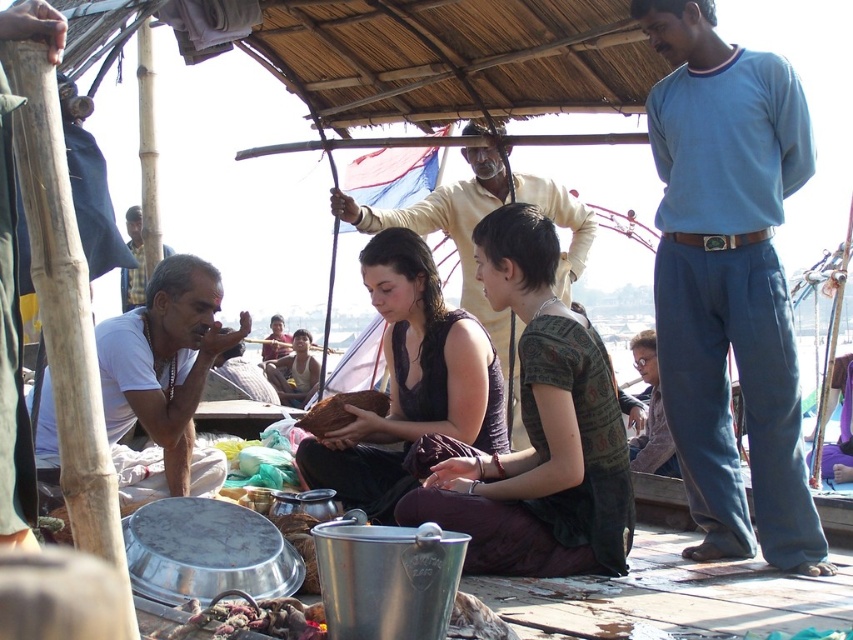
Question: Does matte brown purse at center appear on the right side of light brown fabric shirt at center?

Choices:
 (A) no
 (B) yes

Answer: (A)

Question: Is dark purple fabric at center thinner than matte white shirt at left?

Choices:
 (A) no
 (B) yes

Answer: (B)

Question: Which point is farther to the camera?

Choices:
 (A) matte white shirt at left
 (B) white matte shirt at left
 (C) brown leather bag at center
 (D) dark purple fabric at center

Answer: (C)

Question: Is light yellow shirt at center in front of brown leather bag at center?

Choices:
 (A) yes
 (B) no

Answer: (A)

Question: Which of the following is the closest to the observer?

Choices:
 (A) (477, 218)
 (B) (112, 352)
 (C) (467, 413)

Answer: (B)

Question: Which of these objects is positioned closest to the matte white shirt at left?

Choices:
 (A) white matte shirt at left
 (B) blue cotton shirt at upper right
 (C) light yellow shirt at center

Answer: (A)